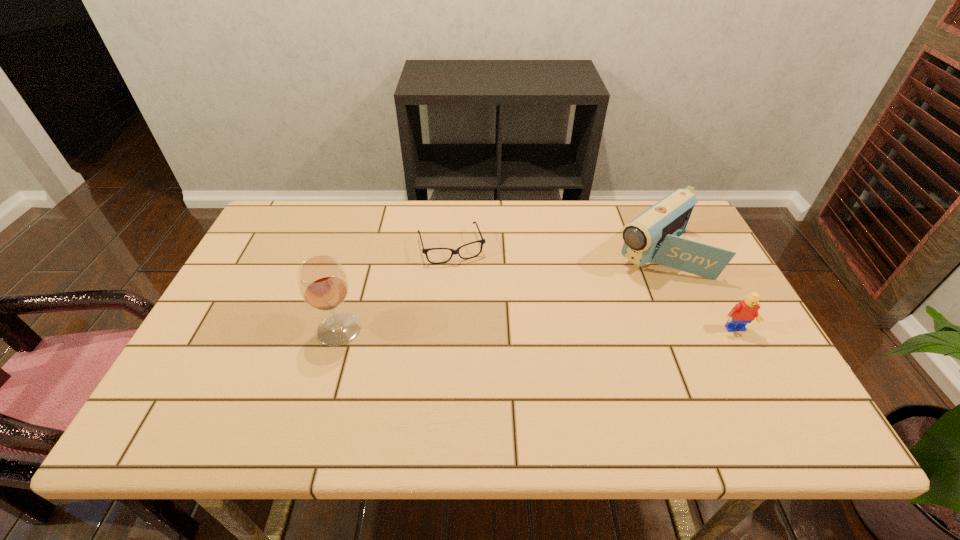
I want to click on vacant space at the near edge, so click(x=630, y=386).

Find the location of a particular element. free point at the left edge is located at coordinates (242, 280).

Identify the location of free space at the right edge of the desktop. (712, 353).

Identify the location of free region at the far left corner. (310, 222).

This screenshot has width=960, height=540. What are the coordinates of `unoccupied area between the Lego and the leftmost object` in the screenshot? It's located at (537, 330).

The image size is (960, 540). I want to click on vacant area that lies between the tallest object and the shortest object, so click(x=395, y=288).

Locate an element on the screen. The image size is (960, 540). free space that is in between the third shortest object and the leftmost object is located at coordinates (498, 291).

Locate an element on the screen. The height and width of the screenshot is (540, 960). empty space between the second shortest object and the tallest object is located at coordinates (537, 330).

The height and width of the screenshot is (540, 960). Find the location of `free space that is in between the wineglass and the second shortest object`. free space that is in between the wineglass and the second shortest object is located at coordinates (537, 330).

Locate an element on the screen. vacant space in between the spectacles and the camcorder is located at coordinates (554, 249).